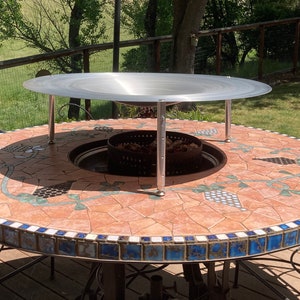
Find the location of a particular element. The width and height of the screenshot is (300, 300). silver metal table legs is located at coordinates (161, 143), (228, 123), (50, 126).